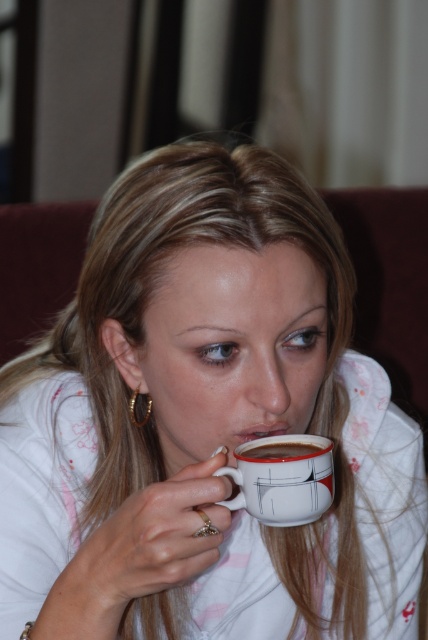
You are a barista trying to place two mugs on a shelf. The shelf has limited space. You have the white glossy mug at center and the white glossy mug at upper center. Which mug should you choose to fit on the shelf if you want the smaller one?

The white glossy mug at upper center is smaller in size than the white glossy mug at center, so you should choose the white glossy mug at upper center to fit on the shelf.

You are a photographer who wants to capture the white glossy mug at center and the white glossy mug at upper center in a new photo. If you move the camera upward, which mug will appear closer to the bottom of the frame?

The white glossy mug at center will appear closer to the bottom of the frame because it is positioned below the white glossy mug at upper center.